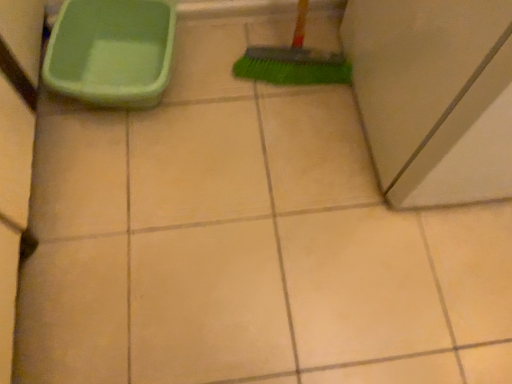
I want to click on vacant point to the left of matte gray cabinet at right, so click(x=262, y=127).